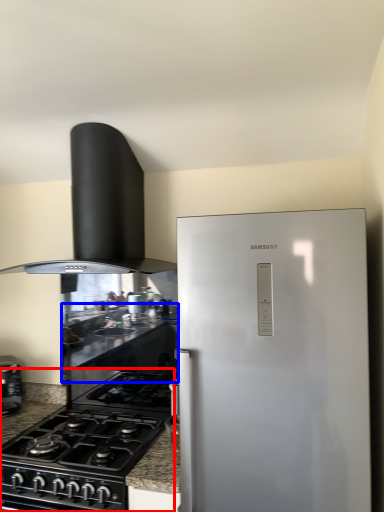
Question: Which object is further to the camera taking this photo, gas stove (highlighted by a red box) or counter top (highlighted by a blue box)?

Choices:
 (A) gas stove
 (B) counter top

Answer: (B)